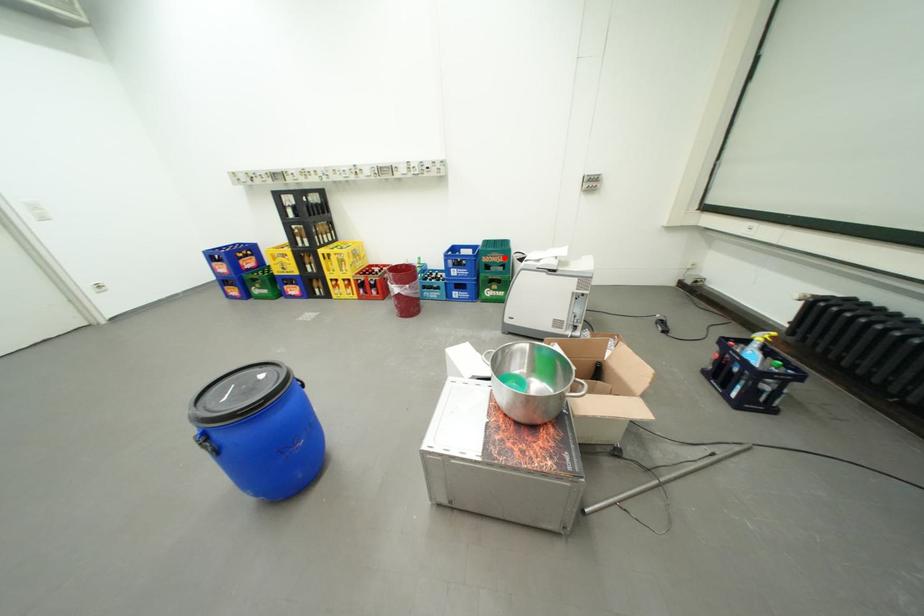
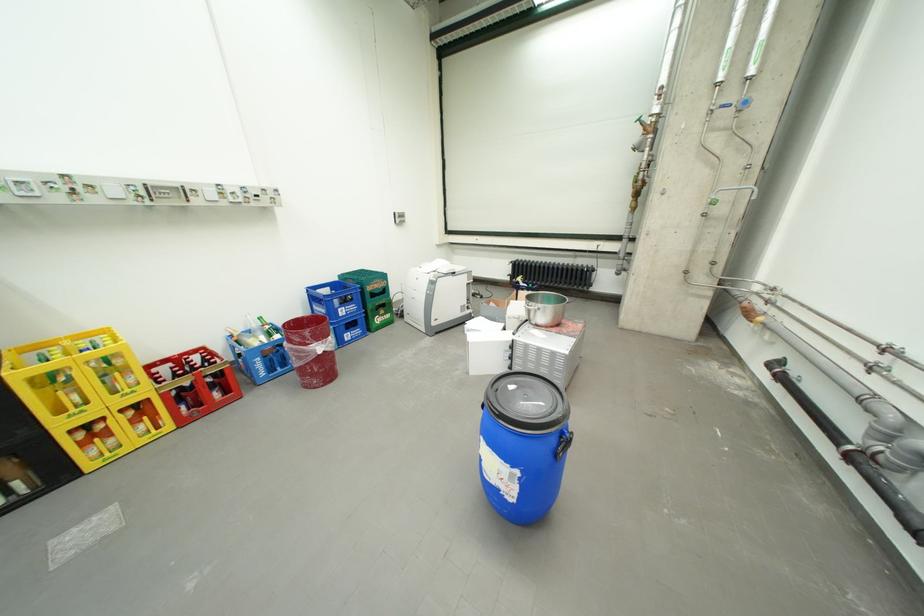
Question: A red point is marked in image1. In image2, is the corresponding 3D point closer to the camera or farther? Reply with the corresponding letter.

Choices:
 (A) The corresponding 3D point is closer.
 (B) The corresponding 3D point is farther.

Answer: (B)